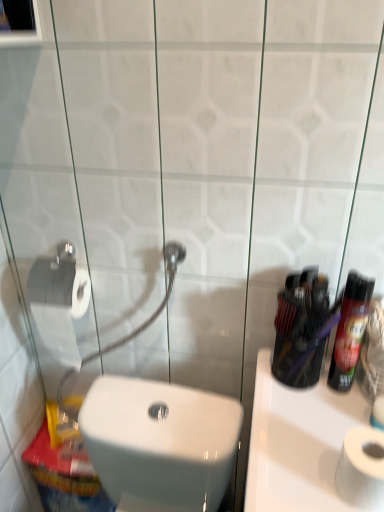
Identify the location of vacant region to the left of white matte toilet paper at lower right. The height and width of the screenshot is (512, 384). (295, 471).